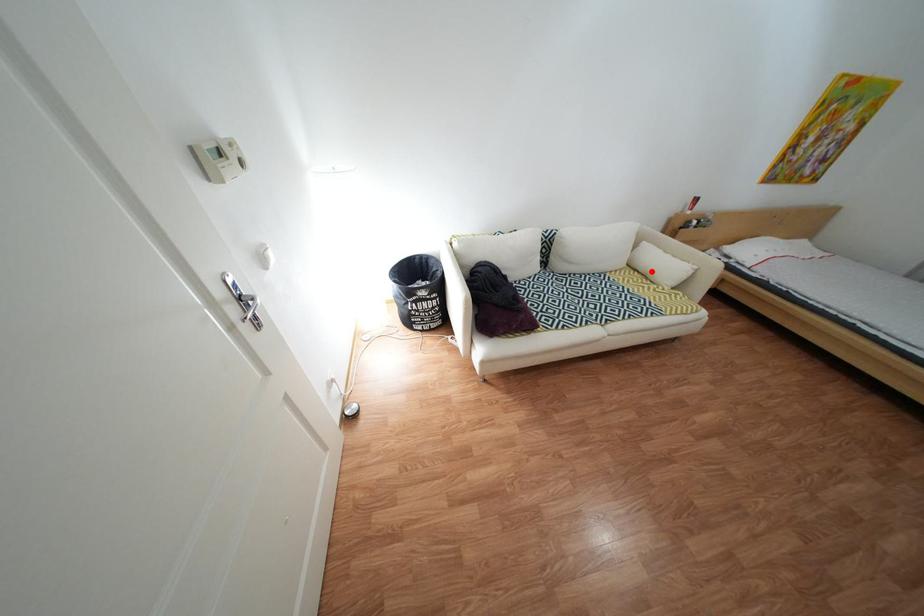
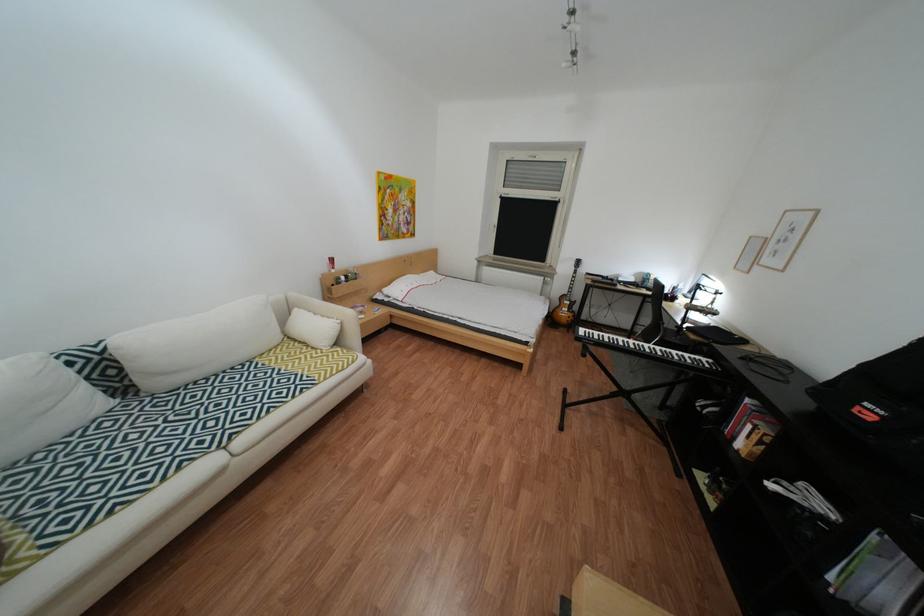
Question: I am providing you with two images of the same scene from different viewpoints. A red point is shown in image1. For the corresponding object point in image2, is it positioned nearer or farther from the camera?

Choices:
 (A) Nearer
 (B) Farther

Answer: (B)